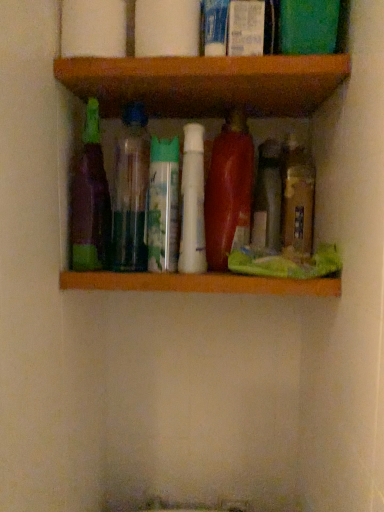
Question: From a real-world perspective, relative to white glossy lotion at upper center, which appears as the second toiletry when viewed from the left, is shiny red plastic bottle at center, the third bottle from the right, vertically above or below?

Choices:
 (A) above
 (B) below

Answer: (B)

Question: In terms of height, does shiny red plastic bottle at center, which is counted as the fourth bottle, starting from the left, look taller or shorter compared to white glossy lotion at upper center, the 1th toiletry in the right-to-left sequence?

Choices:
 (A) short
 (B) tall

Answer: (B)

Question: Estimate the real-world distances between objects in this image. Which object is closer to the wooden shelf at upper center?

Choices:
 (A) shiny red plastic bottle at center, the third bottle from the right
 (B) purple matte bottle at left, which is the first bottle from left to right
 (C) white matte tube at center, marked as the fourth bottle in a right-to-left arrangement
 (D) translucent plastic bottles at center, the 5th bottle positioned from the right
 (E) white glossy lotion at upper center, the 1th toiletry in the right-to-left sequence

Answer: (A)

Question: Estimate the real-world distances between objects in this image. Which object is farther from the white plastic tube at upper center, which is the second toiletry in right-to-left order?

Choices:
 (A) white glossy lotion at upper center, which appears as the second toiletry when viewed from the left
 (B) white matte tube at center, marked as the fourth bottle in a right-to-left arrangement
 (C) wooden shelf at upper center
 (D) translucent plastic bottles at center, the 5th bottle positioned from the right
 (E) green matte spray can at center

Answer: (D)